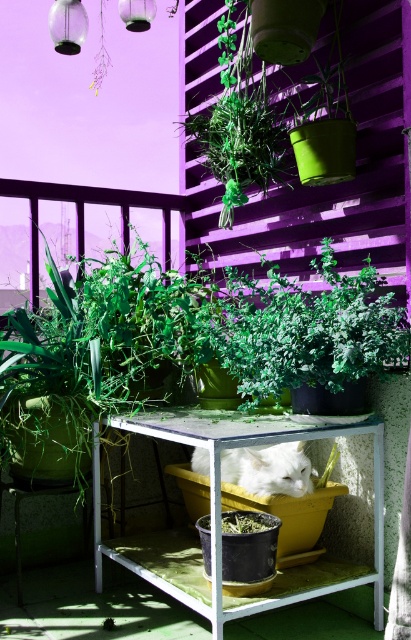
You are standing on the balcony and want to place a 2 meter long ladder on the ground between you and the white metal table at center. Is there enough space for the ladder to fit without bending it?

The distance between you and the white metal table at center is 2.01 meters, so the 2 meter ladder can fit in the space without bending it.

You are standing on the balcony and want to place a small potted plant on the white metal table at center. However, there is a white fluffy cat at center sitting there. Based on their positions, which object is closer to the left edge of the balcony?

The white metal table at center is to the left of the white fluffy cat at center, so the white metal table at center is closer to the left edge of the balcony.

You are standing on the balcony and want to place a small potted plant on the white metal table at center. However, there is a white fluffy cat at center already sitting there. From the observer perspective, which object is blocking your view of the other?

The white metal table at center is in front of the white fluffy cat at center, so the table is blocking the view of the cat.